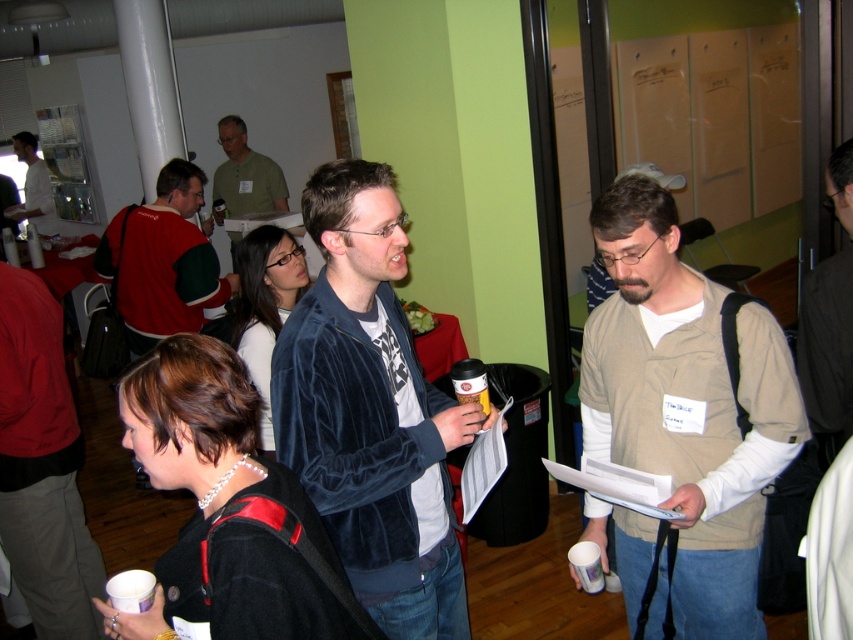
Question: Observing the image, what is the correct spatial positioning of velvet blue jacket at center in reference to dark brown leather jacket at upper right?

Choices:
 (A) below
 (B) above

Answer: (A)

Question: Is dark brown leather jacket at upper right bigger than matte green shirt at center?

Choices:
 (A) no
 (B) yes

Answer: (A)

Question: Which object is farther from the camera taking this photo?

Choices:
 (A) velvet blue jacket at center
 (B) red fabric jacket at center

Answer: (B)

Question: Estimate the real-world distances between objects in this image. Which object is closer to the beige cotton vest at center?

Choices:
 (A) red fabric jacket at center
 (B) matte green shirt at center

Answer: (A)

Question: Which of the following is the farthest from the observer?

Choices:
 (A) (627, 356)
 (B) (369, 163)
 (C) (48, 176)

Answer: (C)

Question: Is velvet blue jacket at center wider than dark brown leather jacket at upper right?

Choices:
 (A) yes
 (B) no

Answer: (A)